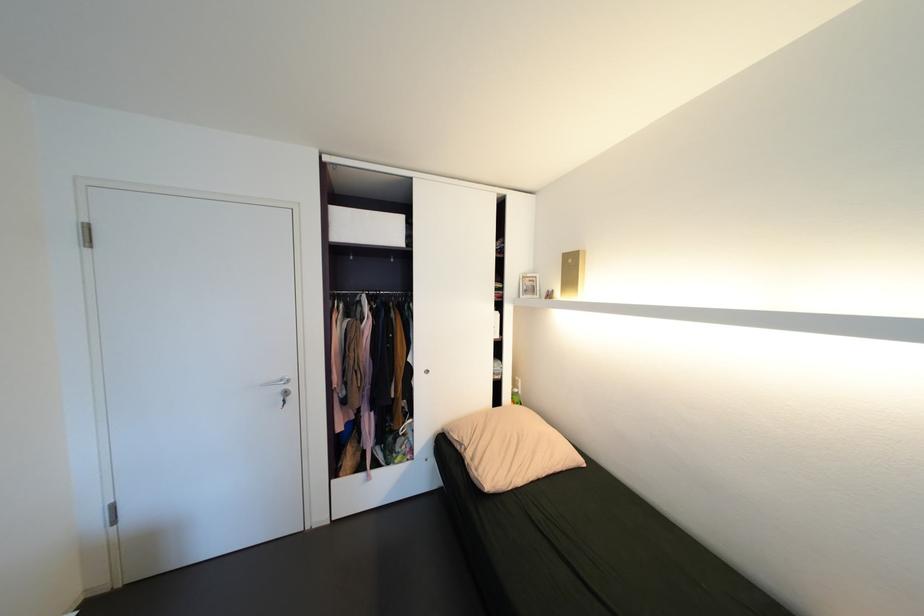
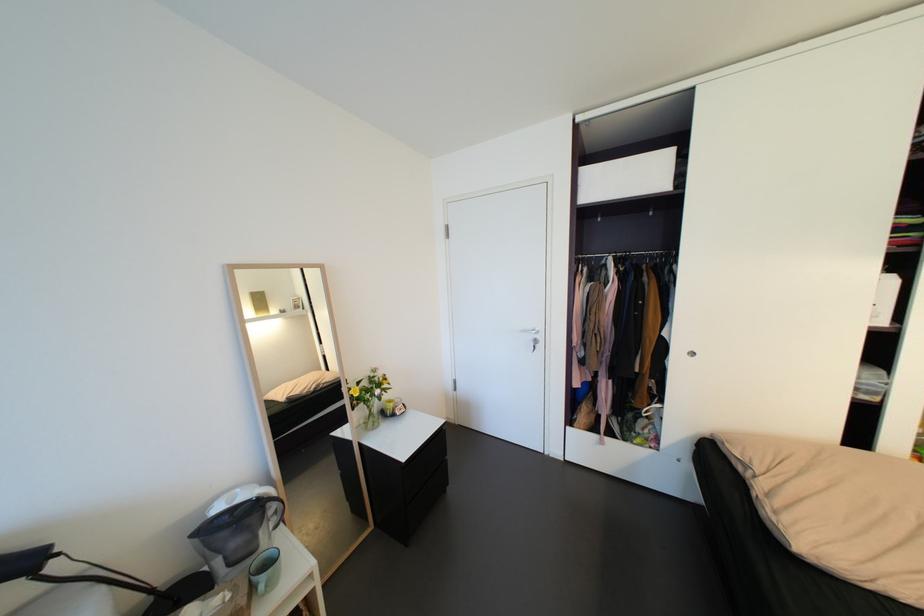
Question: The camera is either moving clockwise (left) or counter-clockwise (right) around the object. The first image is from the beginning of the video and the second image is from the end. Is the camera moving left or right when shooting the video?

Choices:
 (A) Left
 (B) Right

Answer: (B)